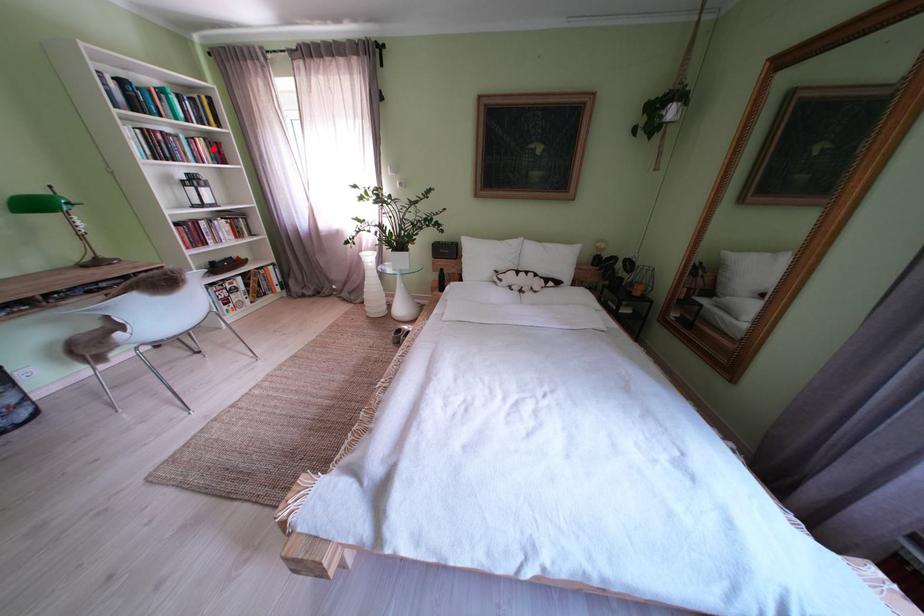
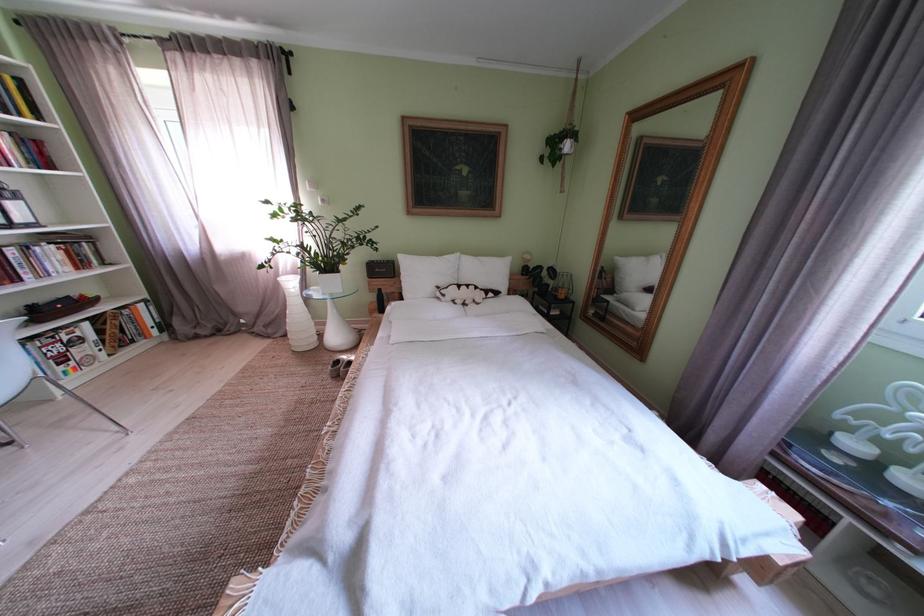
Where in the second image is the point corresponding to the highlighted location from the first image?

(16, 145)